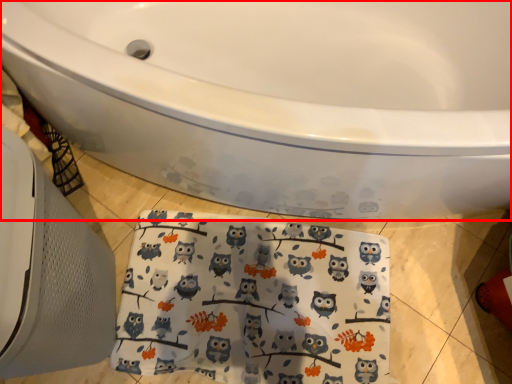
Question: From the image's perspective, where is bathtub (annotated by the red box) located in relation to beach towel in the image?

Choices:
 (A) below
 (B) above

Answer: (B)